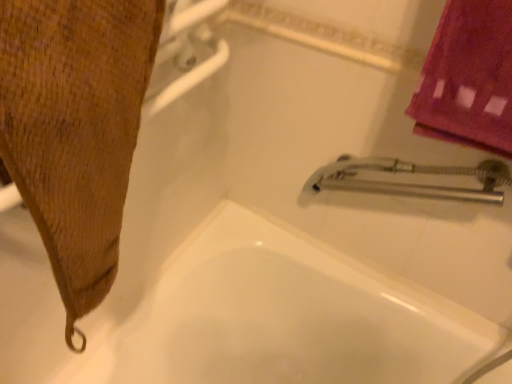
Locate an element on the screen. The image size is (512, 384). brown textured towel at left is located at coordinates (75, 128).

What do you see at coordinates (75, 128) in the screenshot?
I see `brown textured towel at left` at bounding box center [75, 128].

What do you see at coordinates (286, 317) in the screenshot? I see `white glossy bathtub at center` at bounding box center [286, 317].

Locate an element on the screen. white glossy bathtub at center is located at coordinates (286, 317).

Based on the photo, what is the approximate height of white glossy bathtub at center?

21.44 inches.

The image size is (512, 384). I want to click on brown textured towel at left, so click(x=75, y=128).

In the scene shown: Which object is positioned more to the right, brown textured towel at left or white glossy bathtub at center?

white glossy bathtub at center is more to the right.

Who is more distant, brown textured towel at left or white glossy bathtub at center?

white glossy bathtub at center is further from the camera.

Which is less distant, [34,123] or [149,303]?

The point [34,123] is closer to the camera.

From the image's perspective, is brown textured towel at left beneath white glossy bathtub at center?

No, from the image's perspective, brown textured towel at left is not beneath white glossy bathtub at center.

From a real-world perspective, between brown textured towel at left and white glossy bathtub at center, who is vertically lower?

white glossy bathtub at center, from a real-world perspective.

Does brown textured towel at left have a greater width compared to white glossy bathtub at center?

In fact, brown textured towel at left might be narrower than white glossy bathtub at center.

Is brown textured towel at left shorter than white glossy bathtub at center?

Yes.

Is brown textured towel at left smaller than white glossy bathtub at center?

Indeed, brown textured towel at left has a smaller size compared to white glossy bathtub at center.

Is white glossy bathtub at center inside brown textured towel at left?

Definitely not — white glossy bathtub at center is not inside brown textured towel at left.

Is brown textured towel at left in contact with white glossy bathtub at center?

No, brown textured towel at left is not touching white glossy bathtub at center.

Is brown textured towel at left oriented towards white glossy bathtub at center?

No, brown textured towel at left does not turn towards white glossy bathtub at center.

How many degrees apart are the facing directions of brown textured towel at left and white glossy bathtub at center?

They differ by 90 degrees in their facing directions.

The image size is (512, 384). Find the location of `bath that appears behind the brown textured towel at left`. bath that appears behind the brown textured towel at left is located at coordinates (286, 317).

Considering the relative positions of white glossy bathtub at center and brown textured towel at left in the image provided, is white glossy bathtub at center to the left or to the right of brown textured towel at left?

Clearly, white glossy bathtub at center is on the right of brown textured towel at left in the image.

Relative to brown textured towel at left, is white glossy bathtub at center in front or behind?

Visually, white glossy bathtub at center is located behind brown textured towel at left.

Which point is more distant from viewer, (213,268) or (44,62)?

Positioned behind is point (213,268).

From the image's perspective, does white glossy bathtub at center appear higher than brown textured towel at left?

Actually, white glossy bathtub at center appears below brown textured towel at left in the image.

From a real-world perspective, is white glossy bathtub at center over brown textured towel at left?

No, from a real-world perspective, white glossy bathtub at center is not on top of brown textured towel at left.

Is white glossy bathtub at center wider than brown textured towel at left?

Yes, white glossy bathtub at center is wider than brown textured towel at left.

Considering the relative sizes of white glossy bathtub at center and brown textured towel at left in the image provided, is white glossy bathtub at center taller than brown textured towel at left?

Correct, white glossy bathtub at center is much taller as brown textured towel at left.

Considering the sizes of objects white glossy bathtub at center and brown textured towel at left in the image provided, who is bigger, white glossy bathtub at center or brown textured towel at left?

Bigger between the two is white glossy bathtub at center.

Is white glossy bathtub at center not inside brown textured towel at left?

Yes, white glossy bathtub at center is outside of brown textured towel at left.

Would you consider white glossy bathtub at center to be distant from brown textured towel at left?

No, there isn't a large distance between white glossy bathtub at center and brown textured towel at left.

Is white glossy bathtub at center facing away from brown textured towel at left?

white glossy bathtub at center is not turned away from brown textured towel at left.

How different are the orientations of white glossy bathtub at center and brown textured towel at left in degrees?

90 degrees separate the facing orientations of white glossy bathtub at center and brown textured towel at left.

Find the location of `bath that appears below the brown textured towel at left (from the image's perspective)`. bath that appears below the brown textured towel at left (from the image's perspective) is located at coordinates (286, 317).

The height and width of the screenshot is (384, 512). Identify the location of bath lying below the brown textured towel at left (from the image's perspective). (286, 317).

At what (x,y) coordinates should I click in order to perform the action: click on bath behind the brown textured towel at left. Please return your answer as a coordinate pair (x, y). Looking at the image, I should click on (286, 317).